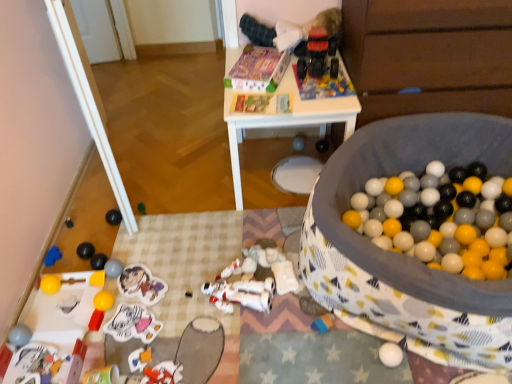
Question: In terms of size, does soft fabric ball pit at center, marked as the first toy in a right-to-left arrangement, appear bigger or smaller than matte gray ball at center, positioned as the eighteenth toy in left-to-right order?

Choices:
 (A) small
 (B) big

Answer: (B)

Question: From a real-world perspective, is soft fabric ball pit at center, the 21th toy from the left, positioned above or below matte gray ball at center, positioned as the eighteenth toy in left-to-right order?

Choices:
 (A) below
 (B) above

Answer: (B)

Question: Considering the real-world distances, which object is closest to the matte gray ball at lower left, arranged as the nineteenth toy when viewed from the right?

Choices:
 (A) rubberized red toy at lower left, the 14th toy positioned from the right
 (B) smooth plastic toy at lower left, placed as the 17th toy when sorted from right to left
 (C) smooth black ball at lower left, the first toy from the left
 (D) matte gray ball at center, which ranks as the fourth toy in right-to-left order
 (E) yellow rubber ball at lower left, positioned as the 9th toy in left-to-right order

Answer: (B)

Question: Which object is positioned farthest from the white matte robot at center, placed as the 7th toy when sorted from right to left?

Choices:
 (A) rubberized red toy truck at upper center, the nineteenth toy from the left
 (B) shiny green ball at center, the eleventh toy in the right-to-left sequence
 (C) blue rubber duck at lower left, acting as the 2th toy starting from the left
 (D) yellow rubber ball at lower left, the 18th toy viewed from the right
 (E) rubberized red toy at lower left, which is counted as the eighth toy, starting from the left

Answer: (A)